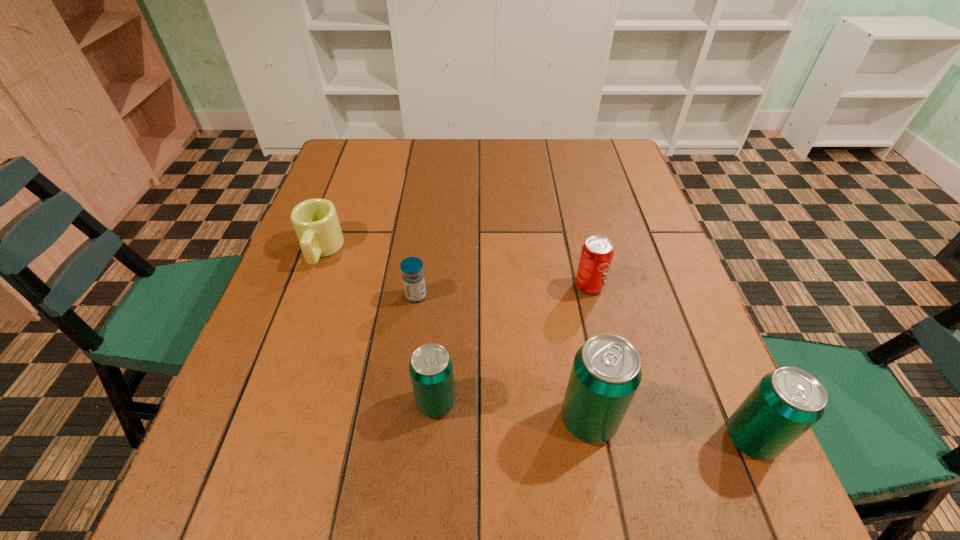
I want to click on vacant area at the left edge of the desktop, so click(332, 202).

The width and height of the screenshot is (960, 540). In the image, there is a desktop. Identify the location of free space at the right edge. (629, 277).

I want to click on free spot at the far left corner of the desktop, so click(x=353, y=157).

This screenshot has width=960, height=540. Identify the location of vacant region at the near left corner. [279, 410].

Locate an element on the screen. vacant area at the near right corner of the desktop is located at coordinates (734, 444).

Find the location of a particular element. free spot between the rightmost beer can and the soda is located at coordinates (670, 362).

Identify the location of empty location between the mug and the soda. (455, 268).

At what (x,y) coordinates should I click in order to perform the action: click on free space between the farthest object and the fourth object from right to left. Please return your answer as a coordinate pair (x, y). The height and width of the screenshot is (540, 960). Looking at the image, I should click on (378, 326).

What are the coordinates of `free space between the second beer can from left to right and the second shortest beer can` in the screenshot? It's located at click(669, 429).

In order to click on empty space between the farthest object and the second beer can from left to right in this screenshot , I will do `click(455, 335)`.